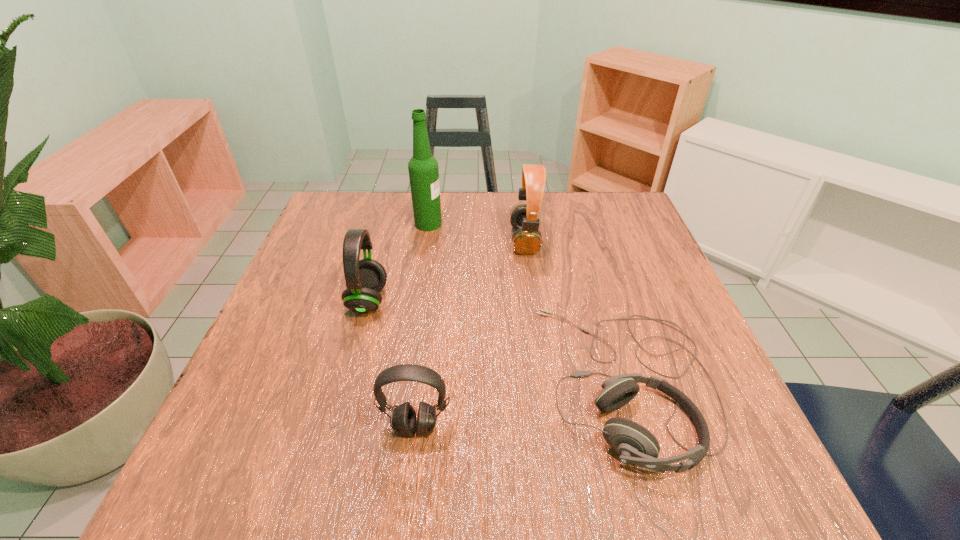
The image size is (960, 540). I want to click on the tallest object, so pos(423,169).

Find the location of a particular element. the farthest headset is located at coordinates (527, 240).

I want to click on the leftmost object, so click(365, 278).

At what (x,y) coordinates should I click in order to perform the action: click on the second shortest object. Please return your answer as a coordinate pair (x, y). The image size is (960, 540). Looking at the image, I should click on (403, 422).

What are the coordinates of `the second shortest headset` in the screenshot? It's located at (403, 422).

The width and height of the screenshot is (960, 540). Find the location of `the shortest object`. the shortest object is located at coordinates (634, 444).

Image resolution: width=960 pixels, height=540 pixels. I want to click on free location located on the label of the tallest object, so click(x=534, y=224).

At what (x,y) coordinates should I click in order to perform the action: click on free space located 0.080m on the ear cups of the farthest headset. Please return your answer as a coordinate pair (x, y). This screenshot has width=960, height=540. Looking at the image, I should click on (478, 240).

Where is `free space located 0.310m on the ear cups of the farthest headset`? free space located 0.310m on the ear cups of the farthest headset is located at coordinates (386, 240).

At what (x,y) coordinates should I click in order to perform the action: click on free space located on the ear cups of the farthest headset. Please return your answer as a coordinate pair (x, y). Looking at the image, I should click on (446, 240).